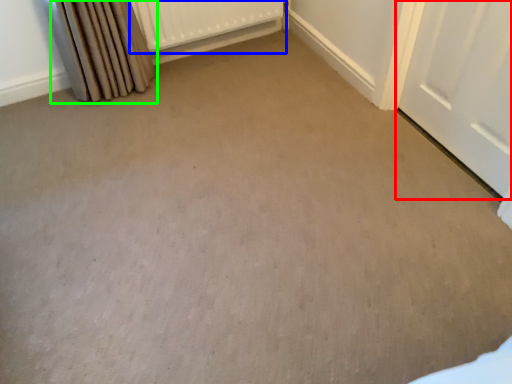
Question: Estimate the real-world distances between objects in this image. Which object is farther from door (highlighted by a red box), radiator (highlighted by a blue box) or curtain (highlighted by a green box)?

Choices:
 (A) radiator
 (B) curtain

Answer: (B)